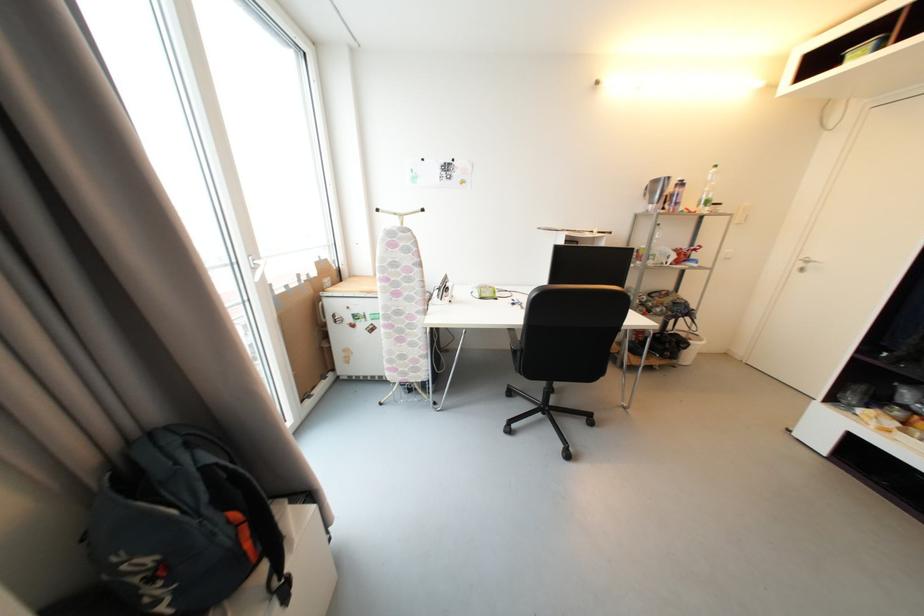
Which object does [181,525] point to?

This point indicates the blue backpack.